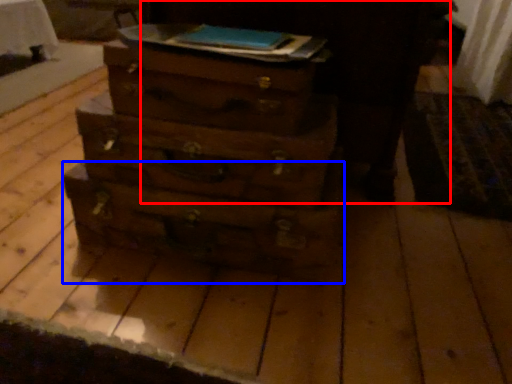
Question: Which object is closer to the camera taking this photo, dark (highlighted by a red box) or drawer (highlighted by a blue box)?

Choices:
 (A) dark
 (B) drawer

Answer: (B)